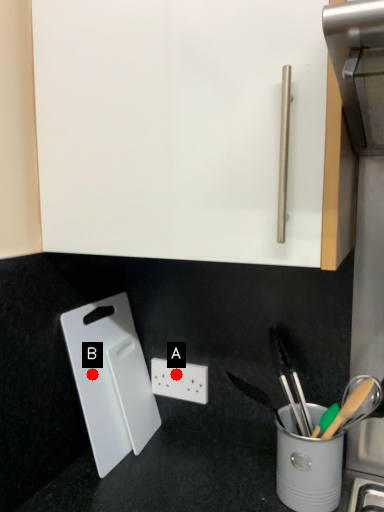
Question: Two points are circled on the image, labeled by A and B beside each circle. Which point is further to the camera?

Choices:
 (A) A is further
 (B) B is further

Answer: (A)